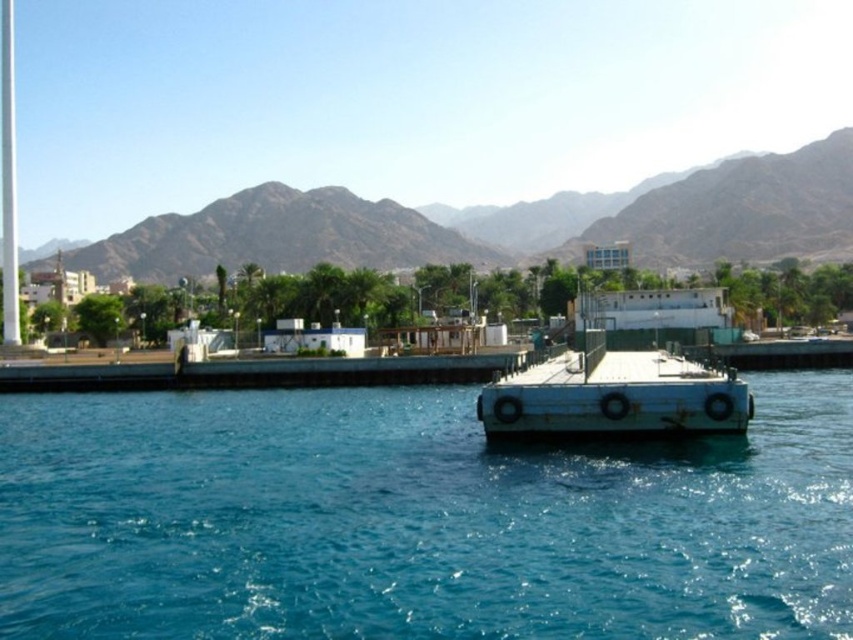
You are standing at the edge of the waterfront scene and want to determine which of the two points, point (691, 227) or point (654, 422), is closer to you. Based on the scene description, which point is nearer?

Point (691, 227) is further to the viewer than point (654, 422). Therefore, point (654, 422) is closer to you.

You are a tourist standing on the white matte dock at center and want to take a photo of the brown rocky mountain at upper center. Which direction should you face to capture the mountain in your photo?

The brown rocky mountain at upper center is positioned on the left side of the white matte dock at center, so you should face to the left to capture the mountain in your photo.